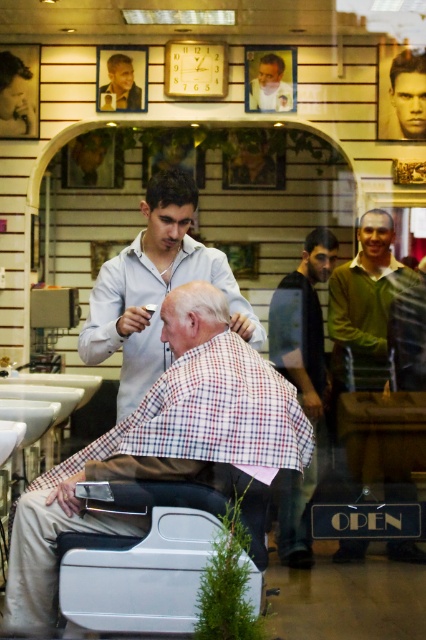
Can you confirm if metallic silver chair at lower center is positioned to the right of smooth skin face at upper center?

Indeed, metallic silver chair at lower center is positioned on the right side of smooth skin face at upper center.

Is metallic silver chair at lower center taller than smooth skin face at upper center?

Yes.

In order to click on metallic silver chair at lower center in this screenshot , I will do `click(141, 557)`.

You are a GUI agent. You are given a task and a screenshot of the screen. Output one action in this format:
    pyautogui.click(x=<x>, y=<y>)
    Task: Click on the metallic silver chair at lower center
    
    Given the screenshot: What is the action you would take?
    pyautogui.click(x=141, y=557)

Which of these two, checkered fabric shirt at center or dark brown hair at center, stands taller?

With more height is checkered fabric shirt at center.

Is checkered fabric shirt at center to the right of dark brown hair at center from the viewer's perspective?

Incorrect, checkered fabric shirt at center is not on the right side of dark brown hair at center.

Who is more forward, [117,266] or [325,243]?

Point [117,266] is more forward.

At what (x,y) coordinates should I click in order to perform the action: click on checkered fabric shirt at center. Please return your answer as a coordinate pair (x, y). This screenshot has width=426, height=640. Looking at the image, I should click on [x=155, y=289].

Is plaid shirt at center to the right of smooth brown hair at center from the viewer's perspective?

No, plaid shirt at center is not to the right of smooth brown hair at center.

Can you confirm if plaid shirt at center is wider than smooth brown hair at center?

Correct, the width of plaid shirt at center exceeds that of smooth brown hair at center.

Is point (301, 502) positioned after point (380, 211)?

No, it is not.

The height and width of the screenshot is (640, 426). Identify the location of plaid shirt at center. (302, 330).